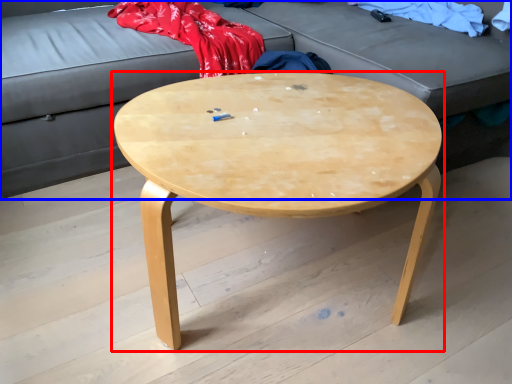
Question: Which object appears farthest to the camera in this image, coffee table (highlighted by a red box) or studio couch (highlighted by a blue box)?

Choices:
 (A) coffee table
 (B) studio couch

Answer: (B)